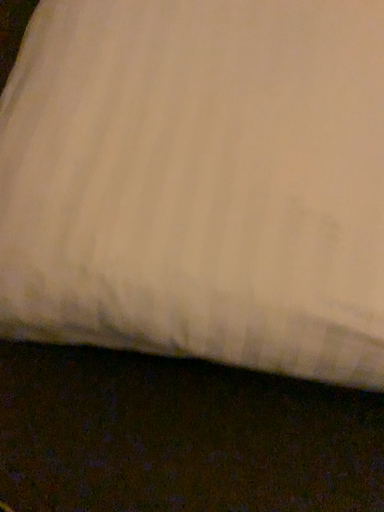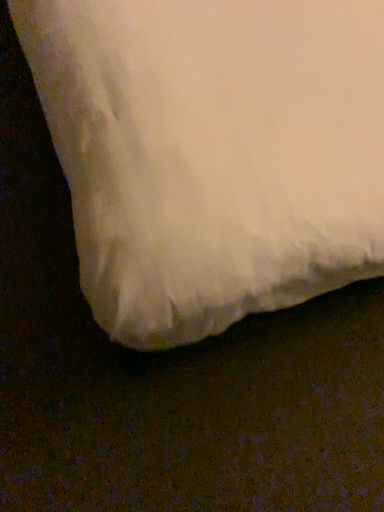
Question: Which way did the camera rotate in the video?

Choices:
 (A) rotated downward
 (B) rotated upward

Answer: (B)